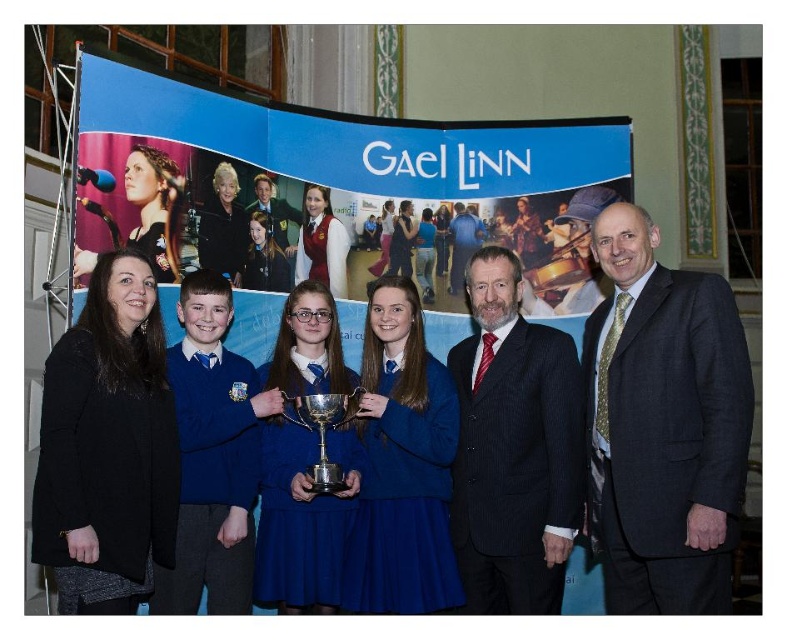
Does point (301, 444) come farther from viewer compared to point (453, 230)?

No, (301, 444) is closer to viewer.

Who is more forward, (x=281, y=442) or (x=451, y=291)?

Point (x=281, y=442) is in front.

Does point (320, 518) lie in front of point (466, 220)?

Yes, it is in front of point (466, 220).

Identify the location of blue fabric dress at center. (301, 518).

Is blue school uniform at left taller than dark suit at center?

Yes.

Who is more forward, (153, 396) or (475, 218)?

Positioned in front is point (153, 396).

Between point (54, 467) and point (455, 260), which one is positioned behind?

Point (455, 260)

Find the location of a particular element. Image resolution: width=787 pixels, height=640 pixels. blue school uniform at left is located at coordinates (106, 445).

Who is taller, blue school uniform at left or silver polished trophy at center?

blue school uniform at left is taller.

Is blue school uniform at left to the right of silver polished trophy at center from the viewer's perspective?

No, blue school uniform at left is not to the right of silver polished trophy at center.

This screenshot has width=787, height=640. What do you see at coordinates (106, 445) in the screenshot?
I see `blue school uniform at left` at bounding box center [106, 445].

The width and height of the screenshot is (787, 640). I want to click on blue school uniform at left, so click(106, 445).